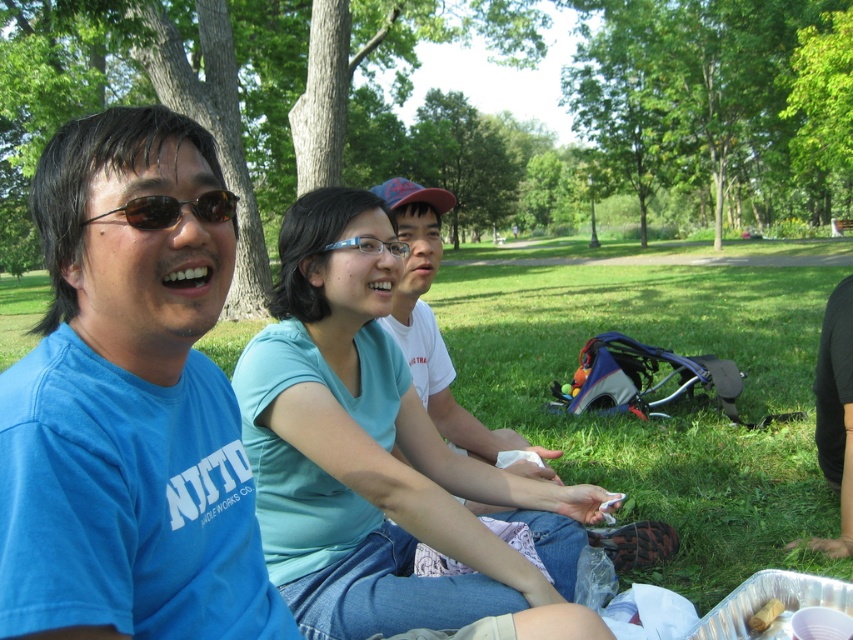
The width and height of the screenshot is (853, 640). Describe the element at coordinates (662, 410) in the screenshot. I see `green grass at center` at that location.

At what (x,y) coordinates should I click in order to perform the action: click on green grass at center. Please return your answer as a coordinate pair (x, y). The image size is (853, 640). Looking at the image, I should click on (662, 410).

Is tortoiseshell plastic sunglasses at upper left shorter than brown paper bag at lower right?

No, tortoiseshell plastic sunglasses at upper left is not shorter than brown paper bag at lower right.

Is point (198, 202) behind point (776, 609)?

No, it is not.

The height and width of the screenshot is (640, 853). What do you see at coordinates (173, 209) in the screenshot? I see `tortoiseshell plastic sunglasses at upper left` at bounding box center [173, 209].

I want to click on tortoiseshell plastic sunglasses at upper left, so click(173, 209).

Does light blue fabric shirt at center have a greater height compared to blue plastic glasses at center?

Yes.

Does light blue fabric shirt at center have a lesser width compared to blue plastic glasses at center?

Incorrect, light blue fabric shirt at center's width is not less than blue plastic glasses at center's.

Locate an element on the screen. light blue fabric shirt at center is located at coordinates [x=374, y=452].